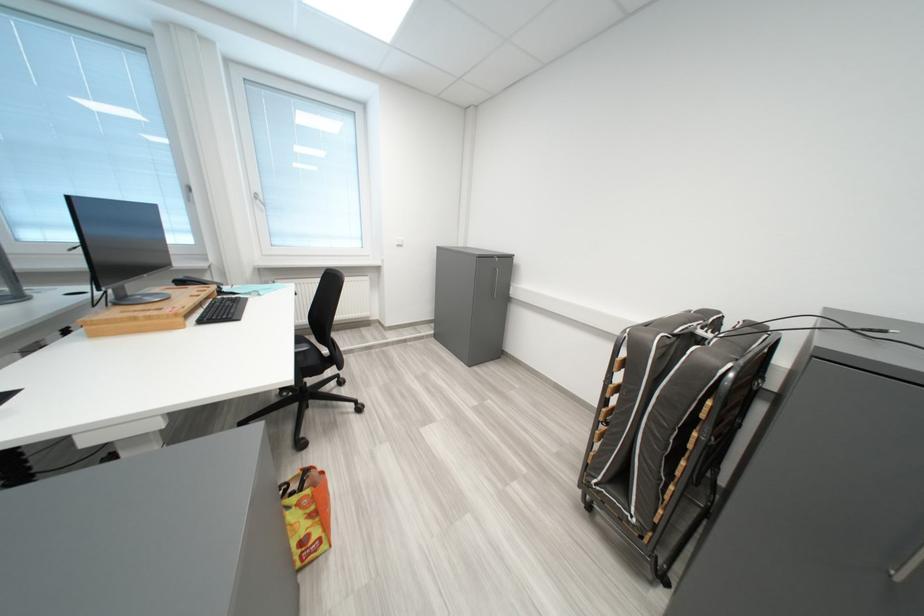
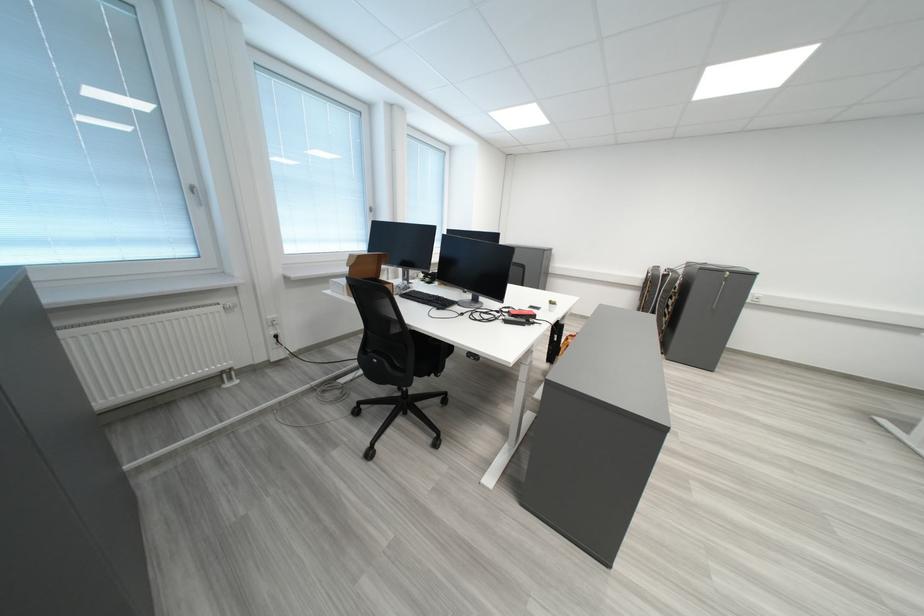
The images are taken continuously from a first-person perspective. In which direction are you moving?

The movement direction of the cameraman is left, backward.